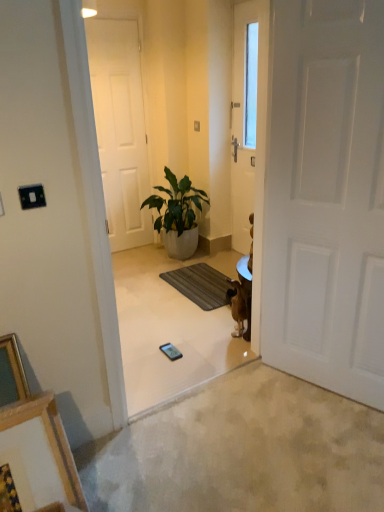
Identify the location of vacant space situated above white matte door at center, which is the second door from right to left (from a real-world perspective). (113, 18).